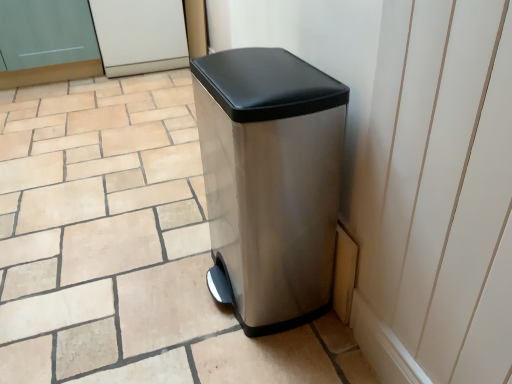
Question: In terms of width, does matte glass screen door at upper left, which is the 2th screen door in right-to-left order, look wider or thinner when compared to white glossy screen door at upper center, which ranks as the first screen door in right-to-left order?

Choices:
 (A) wide
 (B) thin

Answer: (B)

Question: Does point (74, 26) appear closer or farther from the camera than point (122, 24)?

Choices:
 (A) farther
 (B) closer

Answer: (B)

Question: Which of these objects is positioned farthest from the white glossy screen door at upper center, positioned as the second screen door in left-to-right order?

Choices:
 (A) matte silver trash can at center
 (B) stainless steel trash can at center
 (C) matte glass screen door at upper left, which is counted as the first screen door, starting from the left

Answer: (B)

Question: Estimate the real-world distances between objects in this image. Which object is farther from the white glossy screen door at upper center, which ranks as the first screen door in right-to-left order?

Choices:
 (A) stainless steel trash can at center
 (B) matte glass screen door at upper left, which is the 2th screen door in right-to-left order
 (C) matte silver trash can at center

Answer: (A)